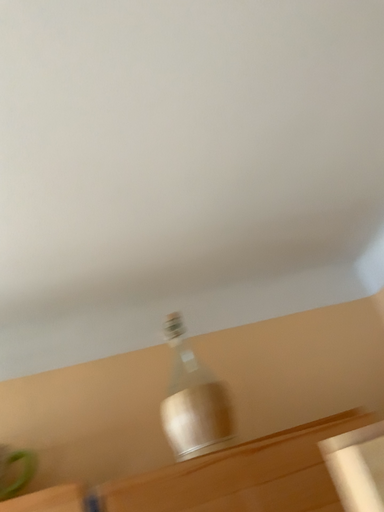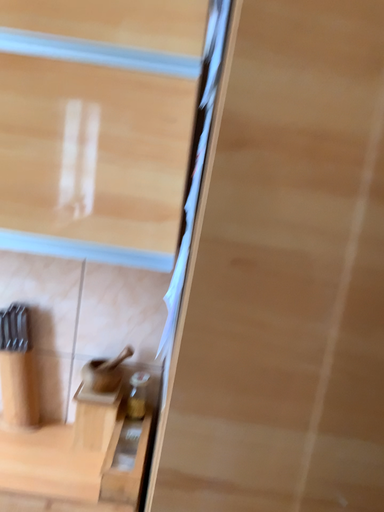
Question: How did the camera likely rotate when shooting the video?

Choices:
 (A) rotated left
 (B) rotated right

Answer: (A)